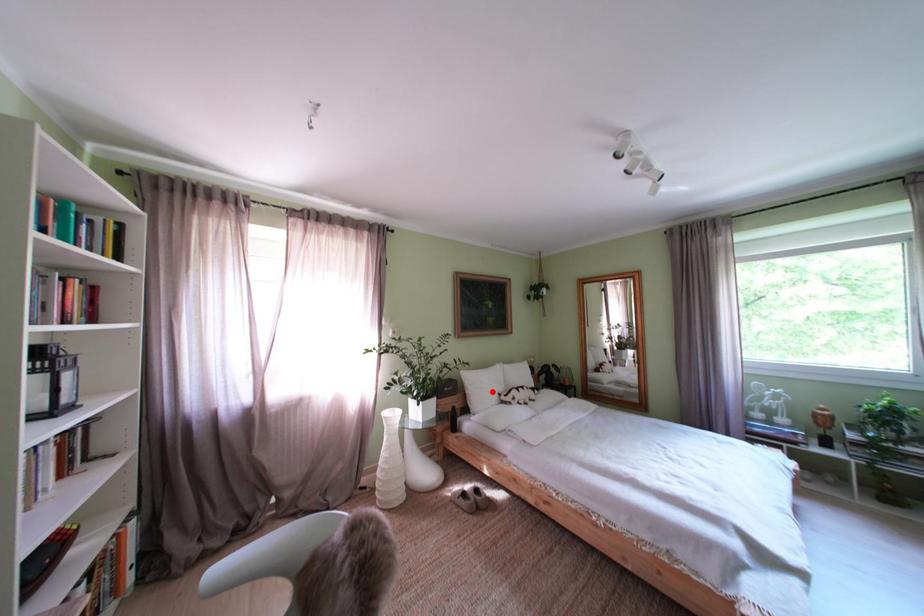
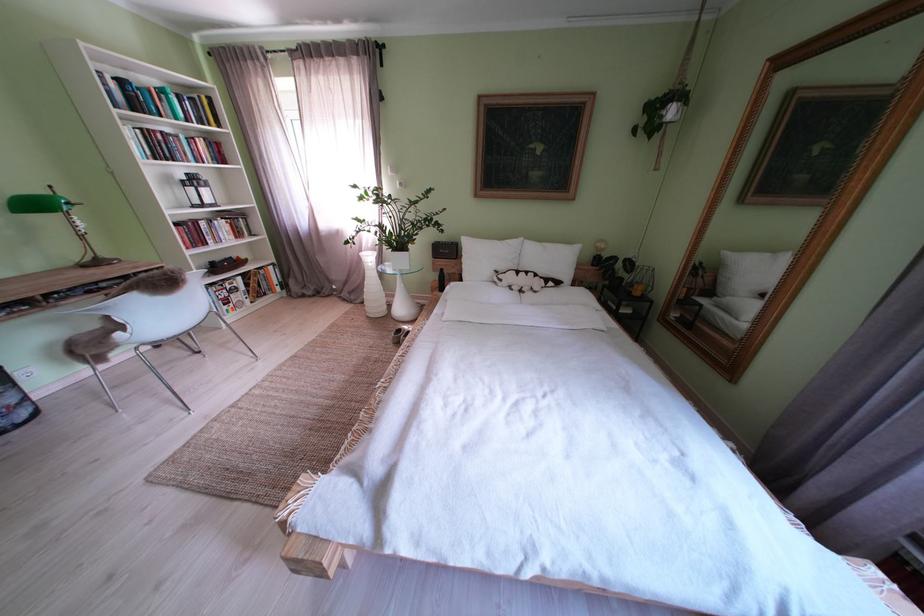
In the second image, find the point that corresponds to the highlighted location in the first image.

(490, 262)